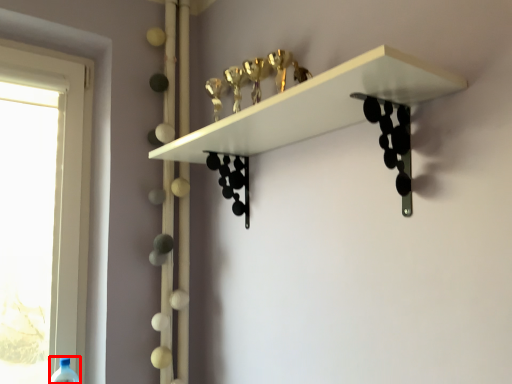
Question: From the image, what is the correct spatial relationship of wine bottle (annotated by the red box) in relation to shelf?

Choices:
 (A) left
 (B) right

Answer: (A)